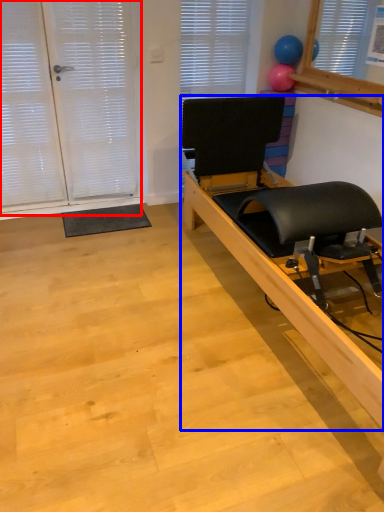
Question: Which point is further to the camera, screen door (highlighted by a red box) or furniture (highlighted by a blue box)?

Choices:
 (A) screen door
 (B) furniture

Answer: (A)